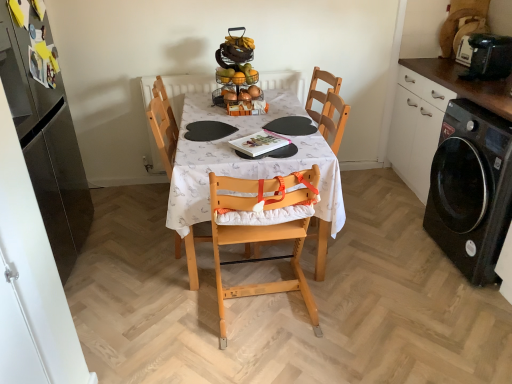
Where is `blank area beneath black plastic toaster at upper right (from a real-world perspective)`? This screenshot has width=512, height=384. blank area beneath black plastic toaster at upper right (from a real-world perspective) is located at coordinates (488, 77).